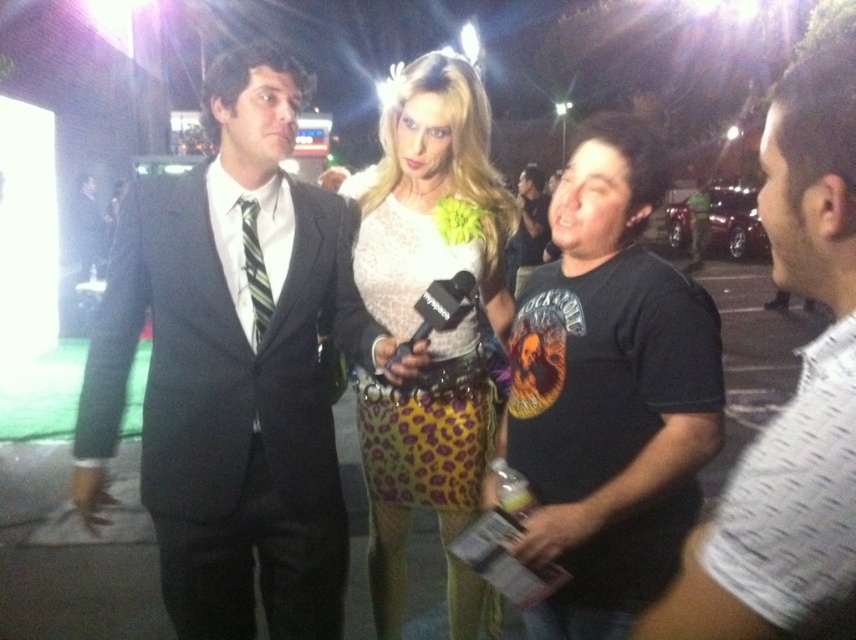
Question: Is matte black suit at left below white textured shirt at right?

Choices:
 (A) no
 (B) yes

Answer: (B)

Question: Which point is closer to the camera taking this photo?

Choices:
 (A) (140, 240)
 (B) (569, 406)

Answer: (B)

Question: Is matte black suit at left to the left of white textured shirt at right from the viewer's perspective?

Choices:
 (A) yes
 (B) no

Answer: (A)

Question: Does matte black suit at left have a greater width compared to white textured shirt at right?

Choices:
 (A) no
 (B) yes

Answer: (B)

Question: Among these objects, which one is farthest from the camera?

Choices:
 (A) lace fabric top at center
 (B) white textured shirt at right
 (C) lace fabric dress at center

Answer: (C)

Question: Estimate the real-world distances between objects in this image. Which object is closer to the matte black suit at left?

Choices:
 (A) black cotton t-shirt at center
 (B) white textured shirt at right
 (C) lace fabric dress at center
 (D) lace fabric top at center

Answer: (C)